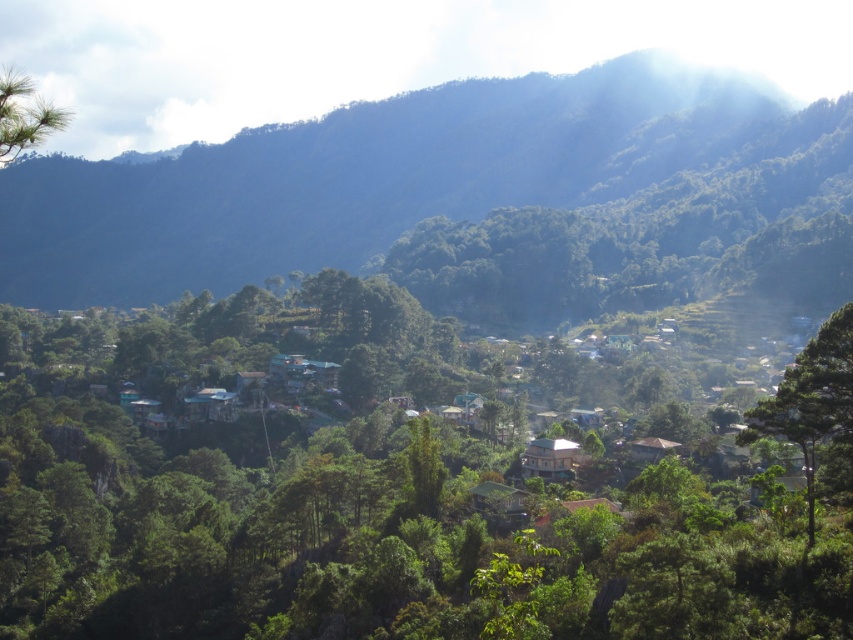
Based on the scene, which object occupies a more prominent position in the image, the green forested mountain at upper center or the green leafy tree at right?

The green forested mountain at upper center is larger in size than the green leafy tree at right, so it occupies a more prominent position in the image.

You are a hiker planning to take a photo of the green forested mountain at upper center and the green leafy tree at right. Which object should you focus on first if you want to capture both in a single frame without moving your camera?

You should focus on the green forested mountain at upper center first because it is taller than the green leafy tree at right, so it will occupy more space in the frame and ensure both are visible.

You are a hiker planning to take a photo of the green leafy tree at center and the green leafy tree at right. Which tree should you stand closer to in order to capture both trees fully in your camera frame?

You should stand closer to the green leafy tree at right because it is smaller in size than the green leafy tree at center. By positioning yourself closer to the smaller tree, you can ensure both trees fit within the camera frame without cropping either of them out.